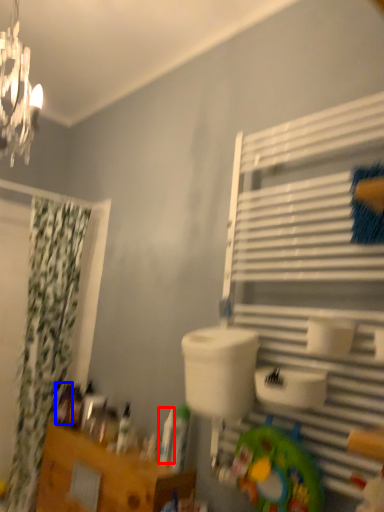
Question: Which point is further to the camera, toiletry (highlighted by a red box) or toiletry (highlighted by a blue box)?

Choices:
 (A) toiletry
 (B) toiletry

Answer: (B)